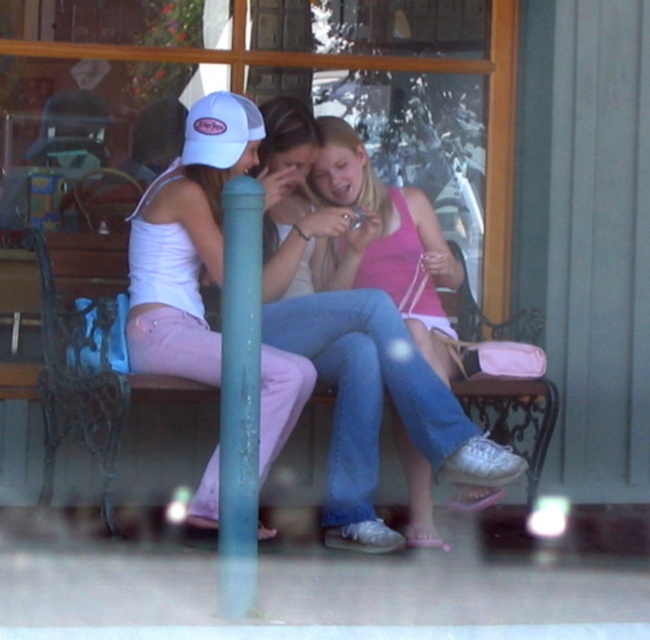
Does wooden bench at center have a larger size compared to white mesh baseball cap at upper left?

Correct, wooden bench at center is larger in size than white mesh baseball cap at upper left.

Is point (118, 413) positioned after point (254, 104)?

That is False.

Locate an element on the screen. This screenshot has width=650, height=640. wooden bench at center is located at coordinates (86, 355).

Can you confirm if white matte tank top at left is shorter than white mesh baseball cap at upper left?

In fact, white matte tank top at left may be taller than white mesh baseball cap at upper left.

Can you confirm if white matte tank top at left is positioned to the right of white mesh baseball cap at upper left?

In fact, white matte tank top at left is to the left of white mesh baseball cap at upper left.

I want to click on white matte tank top at left, so click(187, 241).

Does pink fabric tank top at center have a lesser width compared to wooden bench at center?

In fact, pink fabric tank top at center might be wider than wooden bench at center.

What do you see at coordinates (356, 371) in the screenshot?
I see `pink fabric tank top at center` at bounding box center [356, 371].

This screenshot has width=650, height=640. In order to click on pink fabric tank top at center in this screenshot , I will do `click(356, 371)`.